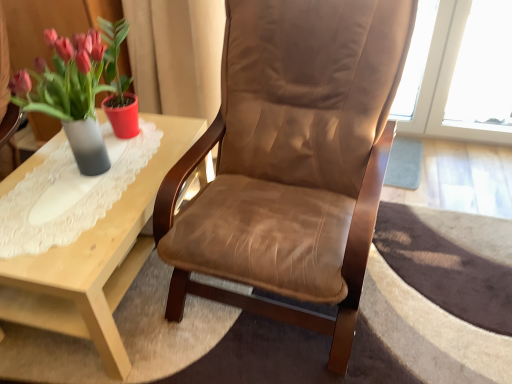
Identify the location of free region on the left part of matte gray vase at left. pos(30,170).